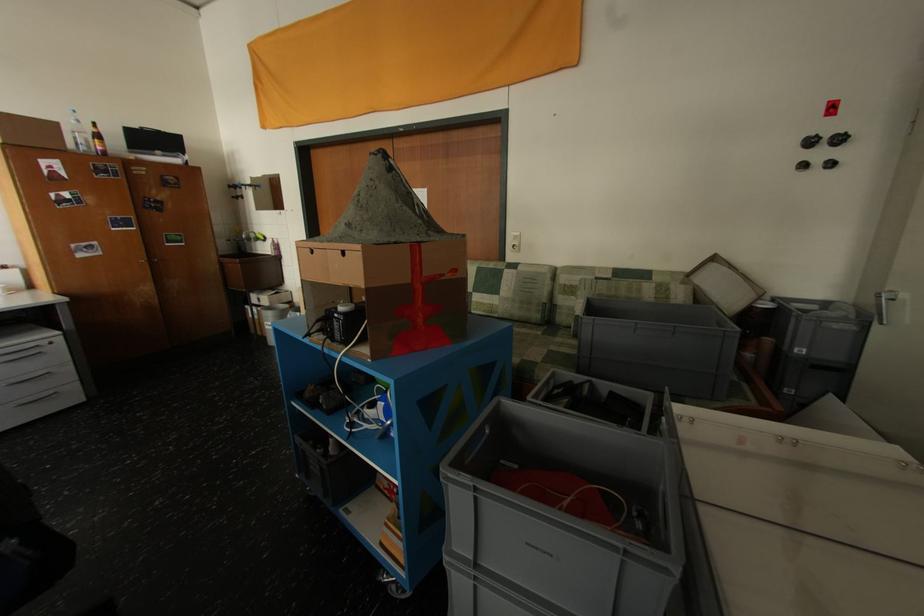
This screenshot has width=924, height=616. I want to click on silver door handle, so click(x=893, y=307).